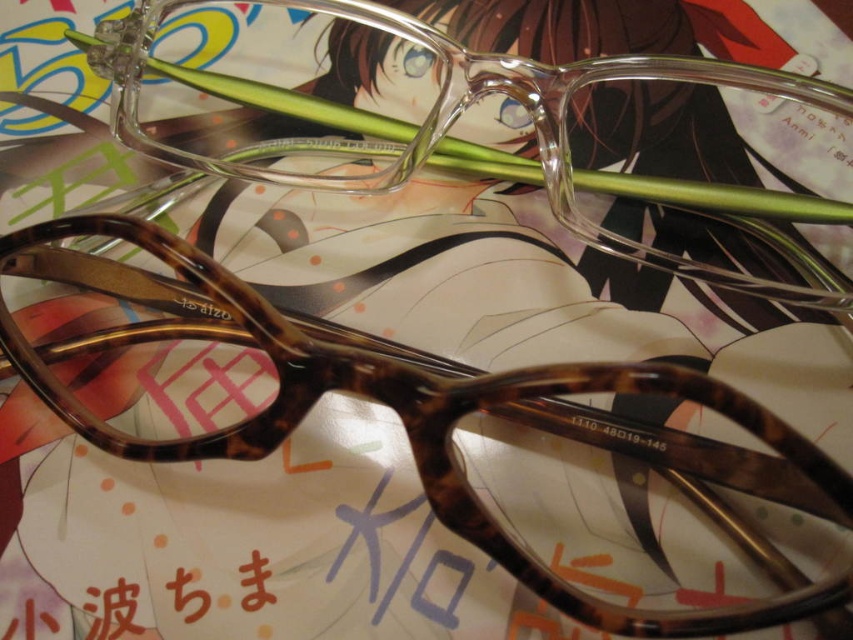
Can you confirm if tortoiseshell acetate glasses at center is positioned to the right of tortoiseshell plastic glasses at center?

No, tortoiseshell acetate glasses at center is not to the right of tortoiseshell plastic glasses at center.

Does tortoiseshell acetate glasses at center have a lesser width compared to tortoiseshell plastic glasses at center?

Yes, tortoiseshell acetate glasses at center is thinner than tortoiseshell plastic glasses at center.

Where is `tortoiseshell acetate glasses at center`? The width and height of the screenshot is (853, 640). tortoiseshell acetate glasses at center is located at coordinates (425, 426).